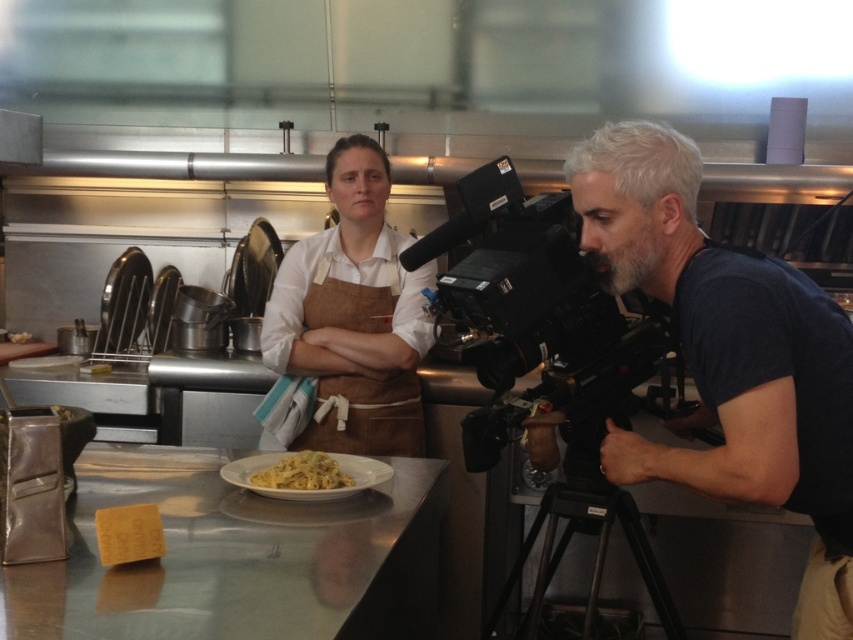
You are a chef working in this kitchen and need to place a large serving tray on the counter. Considering the space occupied by the camera, can you fit the tray on the metallic stainless steel counter at center without moving the black plastic video camera at right?

The metallic stainless steel counter at center has a larger size compared to black plastic video camera at right, so there should be enough space to place the large serving tray on the metallic stainless steel counter at center without moving the black plastic video camera at right.